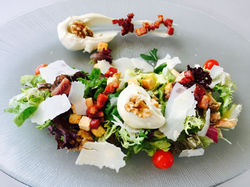
Where is `table`? The height and width of the screenshot is (187, 250). table is located at coordinates (10, 12).